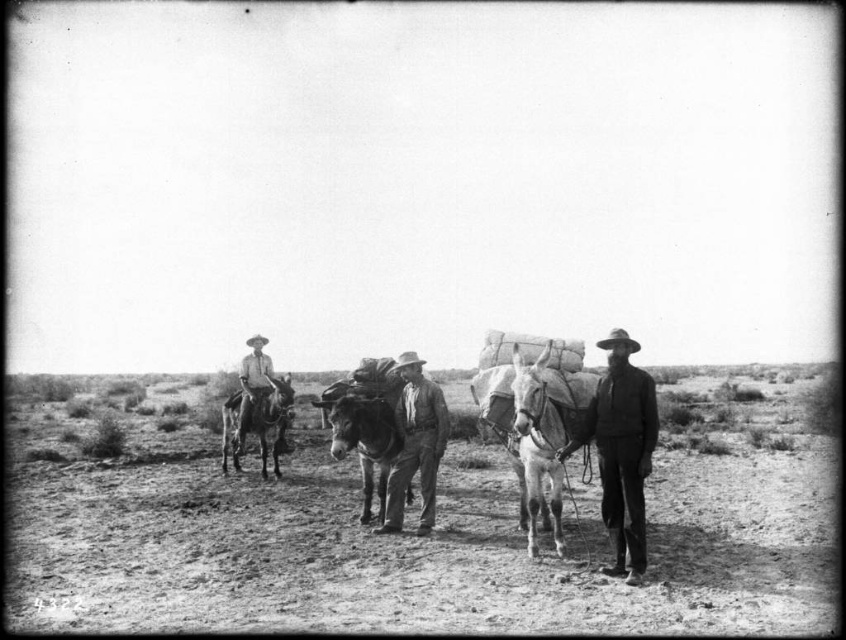
You are a photographer trying to capture a clear image of both the rough leather hat at center and the shiny brown horse at center. Given their sizes, which object should you focus on first to ensure both are in focus?

The rough leather hat at center is smaller than the shiny brown horse at center, so you should focus on the shiny brown horse at center first to ensure both are in focus.

You are a traveler in the desert and see the shiny brown horse at center. If you want to reach the horse, which direction should you move from your current position at the edge of the image?

The shiny brown horse at center is located at coordinates 0.705 on the x axis and 0.636 on the y axis. Since you are at the edge of the image, you should move towards the center to reach it.

From the picture: You are a traveler in the desert and need to choose between the smooth brown mule at center and the shiny brown mule at left to ride. Which mule is closer to you based on their positions in the scene?

The smooth brown mule at center is closer to you because it is positioned in front of the shiny brown mule at left.